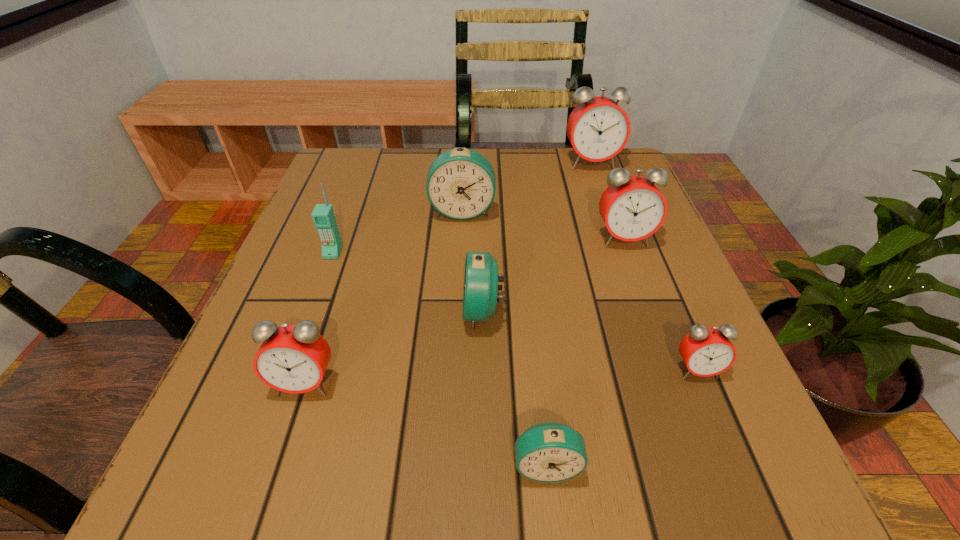
The width and height of the screenshot is (960, 540). I want to click on the biggest red alarm clock, so click(598, 128).

I want to click on the farthest red alarm clock, so click(598, 128).

Where is `the second farthest object`? The image size is (960, 540). the second farthest object is located at coordinates (461, 184).

Image resolution: width=960 pixels, height=540 pixels. I want to click on the sixth nearest alarm clock, so click(461, 184).

Find the location of a particular element. The image size is (960, 540). the third smallest red alarm clock is located at coordinates (632, 207).

In order to click on the third farthest alarm clock in this screenshot , I will do `click(632, 207)`.

This screenshot has width=960, height=540. What are the coordinates of `cellular telephone` in the screenshot? It's located at (323, 216).

The width and height of the screenshot is (960, 540). Find the location of `the fourth nearest alarm clock`. the fourth nearest alarm clock is located at coordinates (480, 287).

You are a GUI agent. You are given a task and a screenshot of the screen. Output one action in this format:
    pyautogui.click(x=<x>, y=<y>)
    Task: Click on the second smallest blue alarm clock
    This screenshot has width=960, height=540.
    Given the screenshot: What is the action you would take?
    pyautogui.click(x=480, y=287)

This screenshot has height=540, width=960. I want to click on the leftmost alarm clock, so click(x=292, y=358).